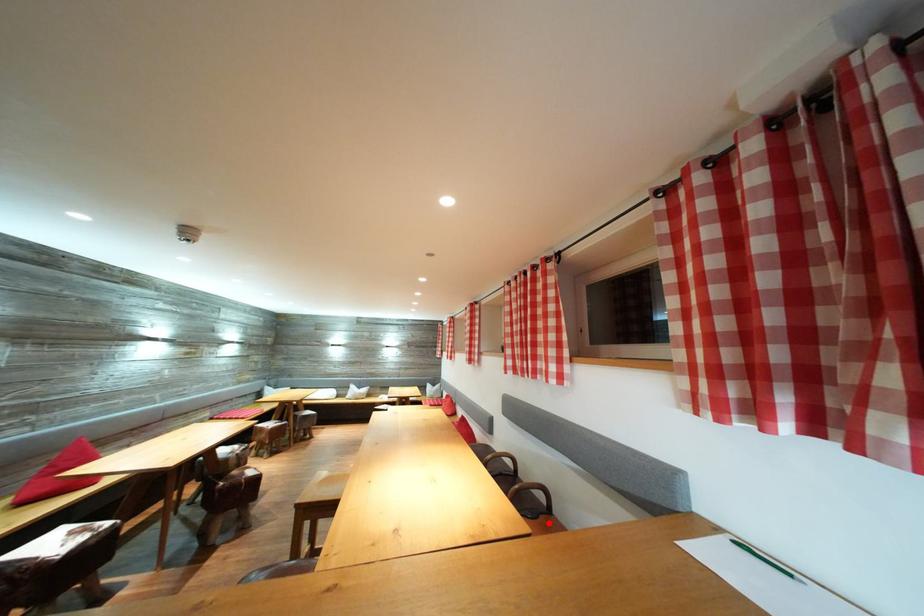
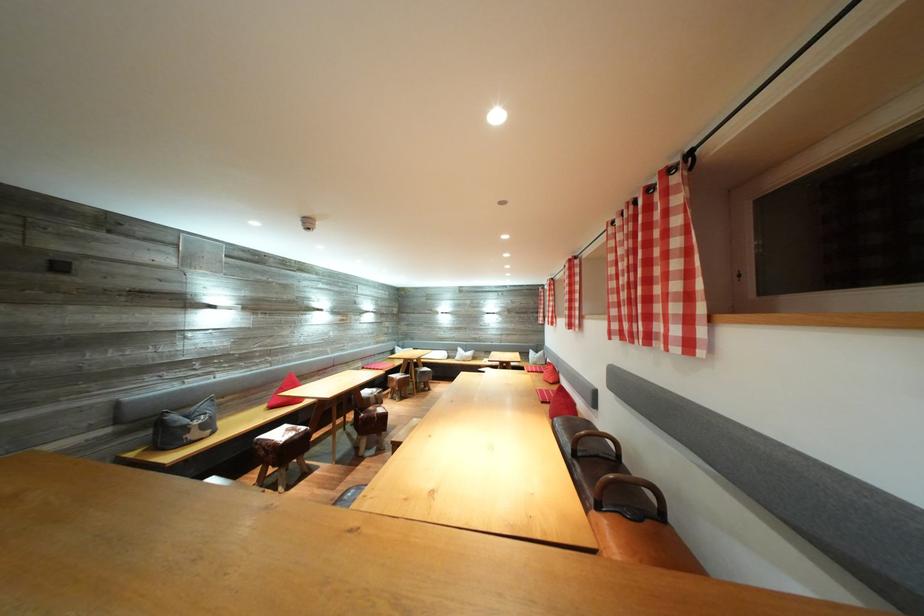
Find the pixel in the second image that matches the highlighted location in the first image.

(655, 529)